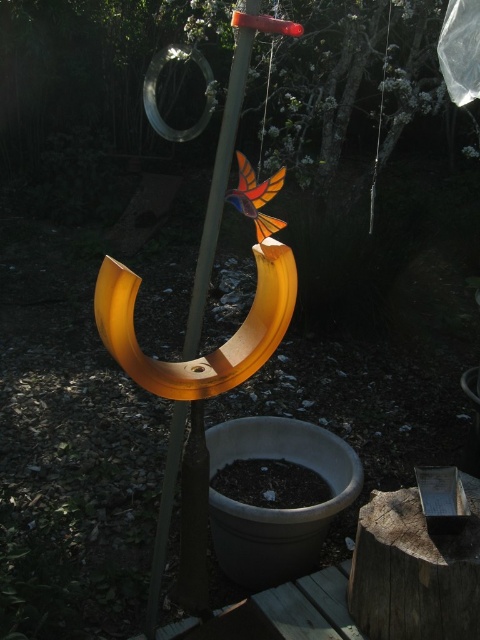
Question: Is transparent plastic bird at center bigger than translucent plastic pole at center?

Choices:
 (A) no
 (B) yes

Answer: (B)

Question: Observing the image, what is the correct spatial positioning of transparent plastic bird at center in reference to translucent plastic pole at center?

Choices:
 (A) left
 (B) right

Answer: (A)

Question: Which point appears closest to the camera in this image?

Choices:
 (A) [181, 426]
 (B) [85, 84]

Answer: (A)

Question: Is transparent plastic bird at center above translucent plastic pole at center?

Choices:
 (A) no
 (B) yes

Answer: (B)